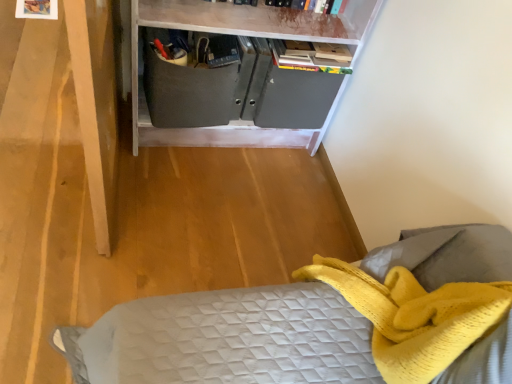
The height and width of the screenshot is (384, 512). Find the location of `matte gray cabinet at center`. matte gray cabinet at center is located at coordinates [x=187, y=92].

What do you see at coordinates (187, 92) in the screenshot? I see `matte gray cabinet at center` at bounding box center [187, 92].

Describe the element at coordinates (247, 27) in the screenshot. This screenshot has width=512, height=384. I see `matte gray cabinet at center` at that location.

What are the coordinates of `matte gray cabinet at center` in the screenshot? It's located at (247, 27).

Find the location of a particular element. The width and height of the screenshot is (512, 384). matte gray cabinet at center is located at coordinates (187, 92).

Considering the relative positions of matte gray cabinet at center and matte gray cabinet at center in the image provided, is matte gray cabinet at center to the right of matte gray cabinet at center from the viewer's perspective?

In fact, matte gray cabinet at center is to the left of matte gray cabinet at center.

Is matte gray cabinet at center closer to camera compared to matte gray cabinet at center?

That is False.

Considering the positions of points (150, 87) and (310, 26), is point (150, 87) closer to camera compared to point (310, 26)?

No, (150, 87) is behind (310, 26).

From the image's perspective, which one is positioned lower, matte gray cabinet at center or matte gray cabinet at center?

matte gray cabinet at center, from the image's perspective.

From a real-world perspective, is matte gray cabinet at center above or below matte gray cabinet at center?

Clearly, from a real-world perspective, matte gray cabinet at center is below matte gray cabinet at center.

Can you confirm if matte gray cabinet at center is wider than matte gray cabinet at center?

No.

Is matte gray cabinet at center taller than matte gray cabinet at center?

No.

Considering the sizes of objects matte gray cabinet at center and matte gray cabinet at center in the image provided, who is bigger, matte gray cabinet at center or matte gray cabinet at center?

matte gray cabinet at center is bigger.

Looking at this image, is matte gray cabinet at center completely or partially outside of matte gray cabinet at center?

No, matte gray cabinet at center is not entirely external to matte gray cabinet at center.

Is matte gray cabinet at center far from matte gray cabinet at center?

No.

Is matte gray cabinet at center facing away from matte gray cabinet at center?

Yes, matte gray cabinet at center is facing away from matte gray cabinet at center.

Find the location of a particular element. drawer on the left side of matte gray cabinet at center is located at coordinates (187, 92).

In the image, is matte gray cabinet at center on the left side or the right side of matte gray cabinet at center?

Clearly, matte gray cabinet at center is on the right of matte gray cabinet at center in the image.

Is matte gray cabinet at center in front of or behind matte gray cabinet at center in the image?

Clearly, matte gray cabinet at center is in front of matte gray cabinet at center.

Considering the points (132, 8) and (186, 89), which point is behind, point (132, 8) or point (186, 89)?

The point (186, 89) is behind.

From the image's perspective, is matte gray cabinet at center above matte gray cabinet at center?

Yes, from the image's perspective, matte gray cabinet at center is on top of matte gray cabinet at center.

From a real-world perspective, relative to matte gray cabinet at center, is matte gray cabinet at center vertically above or below?

From a real-world perspective, matte gray cabinet at center is physically above matte gray cabinet at center.

In terms of width, does matte gray cabinet at center look wider or thinner when compared to matte gray cabinet at center?

In the image, matte gray cabinet at center appears to be wider than matte gray cabinet at center.

Does matte gray cabinet at center have a greater height compared to matte gray cabinet at center?

Yes.

From the picture: Can you confirm if matte gray cabinet at center is bigger than matte gray cabinet at center?

Correct, matte gray cabinet at center is larger in size than matte gray cabinet at center.

Is matte gray cabinet at center situated inside matte gray cabinet at center or outside?

matte gray cabinet at center is spatially situated outside matte gray cabinet at center.

Is matte gray cabinet at center next to matte gray cabinet at center and touching it?

No.

Does matte gray cabinet at center turn towards matte gray cabinet at center?

Yes, matte gray cabinet at center is oriented towards matte gray cabinet at center.

Where is `shelf that appears on the right of matte gray cabinet at center`? This screenshot has width=512, height=384. shelf that appears on the right of matte gray cabinet at center is located at coordinates (247, 27).

At what (x,y) coordinates should I click in order to perform the action: click on drawer on the left of matte gray cabinet at center. Please return your answer as a coordinate pair (x, y). Looking at the image, I should click on (187, 92).

In order to click on drawer that is behind the matte gray cabinet at center in this screenshot , I will do `click(187, 92)`.